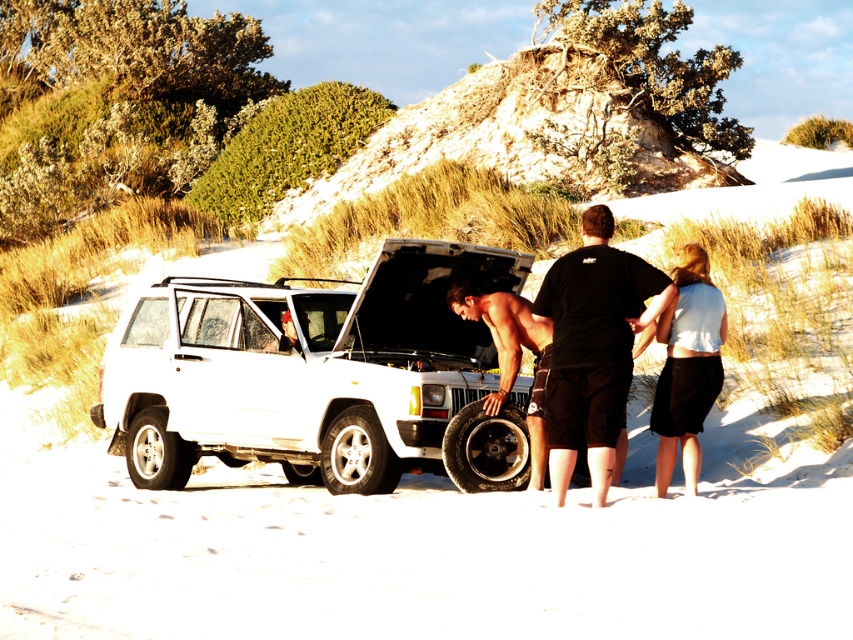
You are standing in the sandy area and want to move from point A to point B. Point A is located at coordinate point (370, 324) and point B is at coordinate point (675, 352). Which point is closer to you?

Point A at coordinate point (370, 324) is closer to you because it is further to the viewer than point B at coordinate point (675, 352).

You are standing near the white matte suv at center and want to reach a first aid kit located 10 meters behind you. Can you walk straight back without moving the suv to do so?

The white matte suv at center is 9.86 meters from viewer, so walking straight back 10 meters would place you slightly behind the suv, allowing you to reach the first aid kit without needing to move it.

You are a photographer planning to take a wide shot of the scene. The white matte suv at center and the black matte shirt at center are both in the frame. Which object is wider in the image?

The white matte suv at center is wider than the black matte shirt at center.